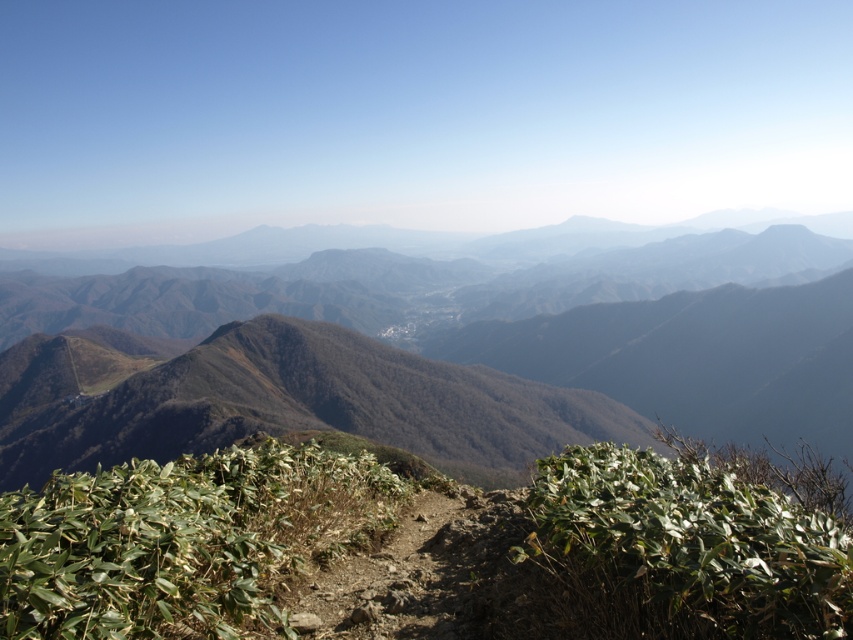
Question: Where is brown/drymaterial/texture mountain range at center located in relation to green leafy plant at center in the image?

Choices:
 (A) above
 (B) below

Answer: (A)

Question: Does green leafy shrub at center appear on the right side of green leafy plant at center?

Choices:
 (A) yes
 (B) no

Answer: (B)

Question: Does brown/drymaterial/texture mountain range at center lie behind green leafy plant at center?

Choices:
 (A) no
 (B) yes

Answer: (B)

Question: Which of the following is the closest to the observer?

Choices:
 (A) (132, 384)
 (B) (169, 589)

Answer: (B)

Question: Which point is farther to the camera?

Choices:
 (A) (778, 627)
 (B) (248, 481)

Answer: (B)

Question: Which point is farther to the camera?

Choices:
 (A) (91, 380)
 (B) (602, 616)

Answer: (A)